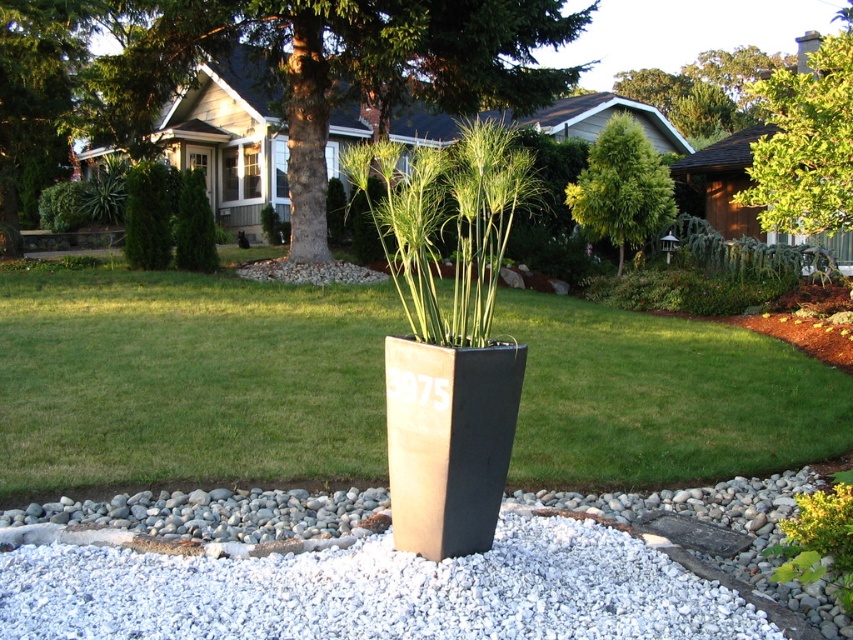
Question: Among these points, which one is farthest from the camera?

Choices:
 (A) (819, 113)
 (B) (610, 147)
 (C) (740, 364)

Answer: (B)

Question: Is green textured tree at center positioned before green textured tree at upper center?

Choices:
 (A) no
 (B) yes

Answer: (B)

Question: Can you confirm if white gravel at center is wider than green leafy tree at upper right?

Choices:
 (A) no
 (B) yes

Answer: (A)

Question: Which of the following is the farthest from the observer?

Choices:
 (A) (105, 296)
 (B) (108, 612)
 (C) (648, 236)

Answer: (C)

Question: Among these objects, which one is farthest from the camera?

Choices:
 (A) white gravel at center
 (B) green grass at center
 (C) green textured tree at center

Answer: (C)

Question: Can you confirm if green textured tree at center is positioned below green leafy tree at upper right?

Choices:
 (A) yes
 (B) no

Answer: (A)